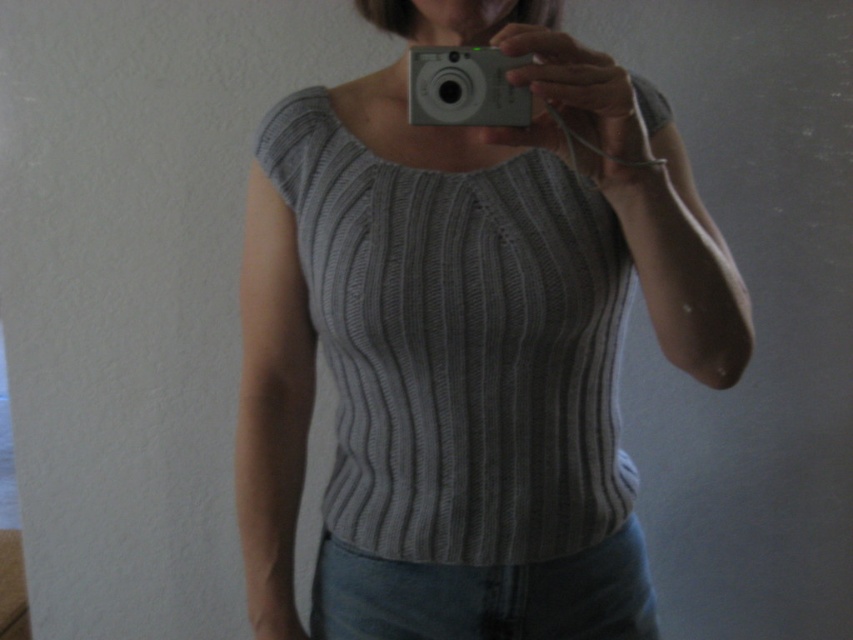
Question: Observing the image, what is the correct spatial positioning of gray ribbed knit top at center in reference to white plastic camera at upper center?

Choices:
 (A) above
 (B) below

Answer: (B)

Question: Where is gray ribbed knit top at center located in relation to white plastic camera at upper center in the image?

Choices:
 (A) right
 (B) left

Answer: (A)

Question: Observing the image, what is the correct spatial positioning of gray ribbed knit top at center in reference to white plastic camera at upper center?

Choices:
 (A) below
 (B) above

Answer: (A)